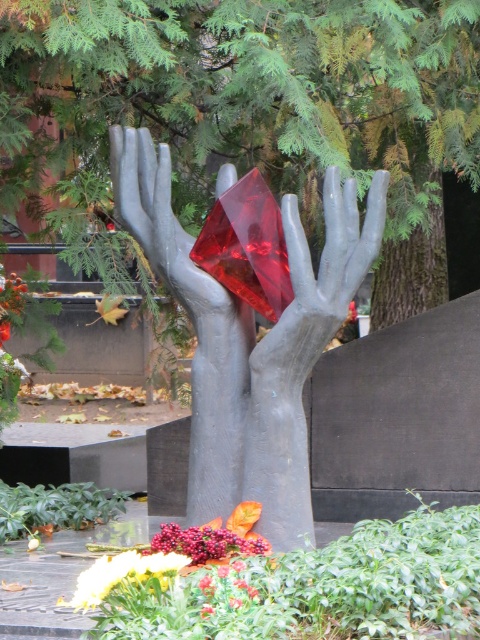
Does green leafy tree at center appear on the right side of matte gray hand at center?

No, green leafy tree at center is not to the right of matte gray hand at center.

Between green leafy tree at center and matte gray hand at center, which one appears on the left side from the viewer's perspective?

Positioned to the left is green leafy tree at center.

Locate an element on the screen. This screenshot has width=480, height=640. green leafy tree at center is located at coordinates (257, 100).

This screenshot has width=480, height=640. What are the coordinates of `green leafy tree at center` in the screenshot? It's located at [257, 100].

Can you confirm if matte red diamond at center is wider than matte gray hand at center?

Indeed, matte red diamond at center has a greater width compared to matte gray hand at center.

Is matte red diamond at center behind matte gray hand at center?

No, matte red diamond at center is closer to the viewer.

Is point (179, 284) in front of point (331, 225)?

No, (179, 284) is further to viewer.

You are a GUI agent. You are given a task and a screenshot of the screen. Output one action in this format:
    pyautogui.click(x=<x>, y=<y>)
    Task: Click on the matte red diamond at center
    The height and width of the screenshot is (640, 480).
    Given the screenshot: What is the action you would take?
    pyautogui.click(x=250, y=339)

Is green leafy tree at center above matte red diamond at center?

Result: Yes.

Which of these two, green leafy tree at center or matte red diamond at center, stands taller?

matte red diamond at center is taller.

The height and width of the screenshot is (640, 480). I want to click on green leafy tree at center, so pyautogui.click(x=257, y=100).

Identify the location of green leafy tree at center. Image resolution: width=480 pixels, height=640 pixels. (257, 100).